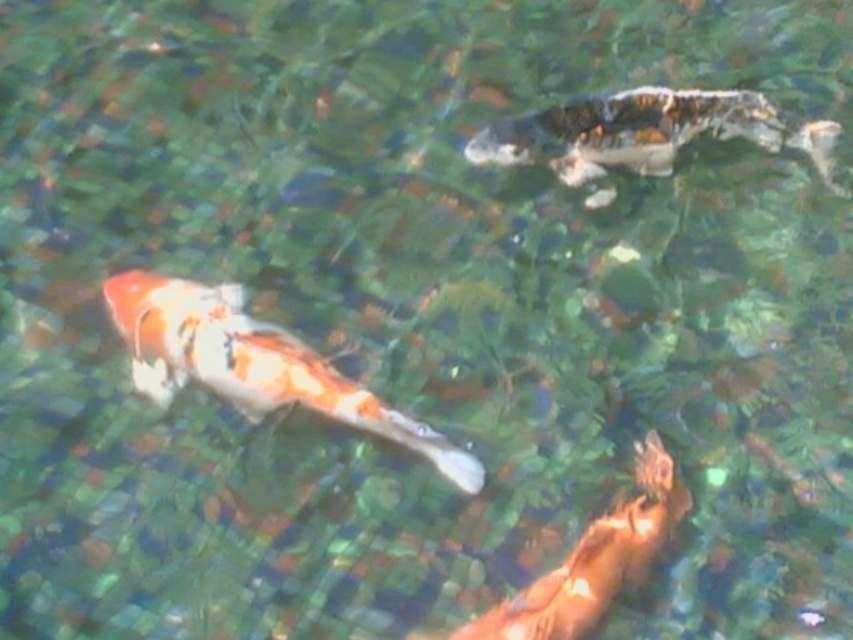
You are an underwater photographer aiming to capture both the orange and white scaled fish at center and the orange and white scaled fish at bottom right in a single frame. Given their positions, which fish should you position your camera closer to in order to include both in the shot?

You should position your camera closer to the orange and white scaled fish at center because it is on the left side of the orange and white scaled fish at bottom right, allowing both to be captured in the frame when centered appropriately.

You are a photographer trying to capture both the speckled white fish at upper right and the orange and white scaled fish at bottom right in a single frame. Based on their positions, which fish is closer to the camera?

The speckled white fish at upper right is closer to the camera than the orange and white scaled fish at bottom right because it is positioned higher in the frame, which typically indicates closer proximity in such scenes.

Based on the photo, you are a photographer trying to capture the orange and white scaled fish at center in the pond. The point marked at coordinates (252, 364) indicates where the fish is located. If you want to focus on this fish, should you adjust your camera lens to zoom in or out compared to the default setting?

The point marked at (252, 364) marks the orange and white scaled fish at center. Since the fish is already at the center, you should zoom in to focus on it without moving the camera position.